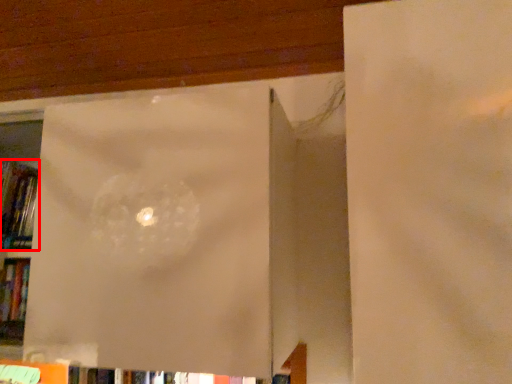
Question: From the image's perspective, considering the relative positions of book (annotated by the red box) and window frame in the image provided, where is book (annotated by the red box) located with respect to the staircase?

Choices:
 (A) above
 (B) below

Answer: (A)